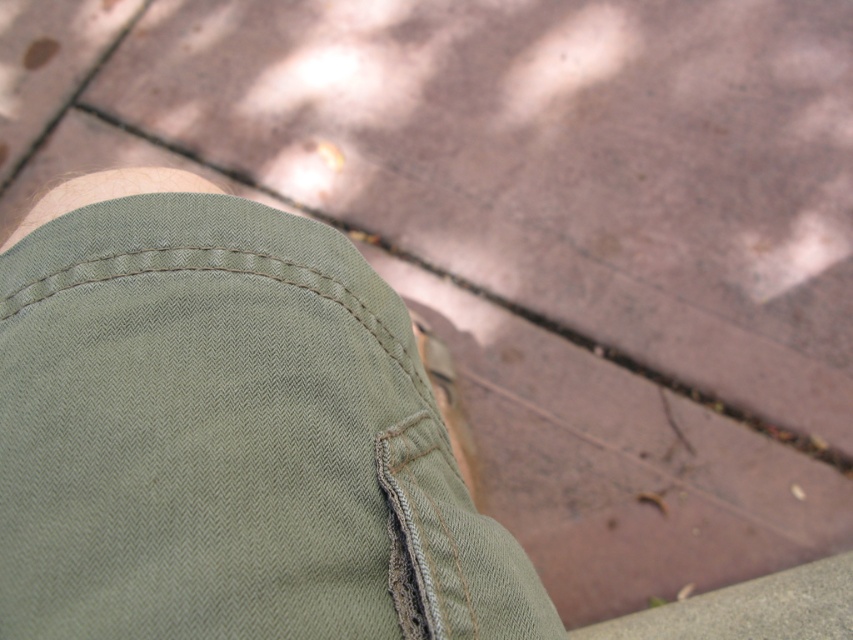
Who is taller, olive-green denim shorts at center or light brown suede shoe at lower center?

Standing taller between the two is light brown suede shoe at lower center.

Is olive-green denim shorts at center closer to the viewer compared to light brown suede shoe at lower center?

Yes, it is in front of light brown suede shoe at lower center.

Is point (103, 268) positioned in front of point (473, 464)?

Yes, it is in front of point (473, 464).

Where is `olive-green denim shorts at center`? The height and width of the screenshot is (640, 853). olive-green denim shorts at center is located at coordinates (225, 433).